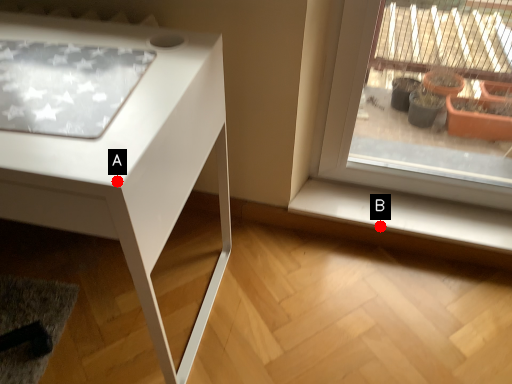
Question: Two points are circled on the image, labeled by A and B beside each circle. Which point is closer to the camera?

Choices:
 (A) A is closer
 (B) B is closer

Answer: (A)